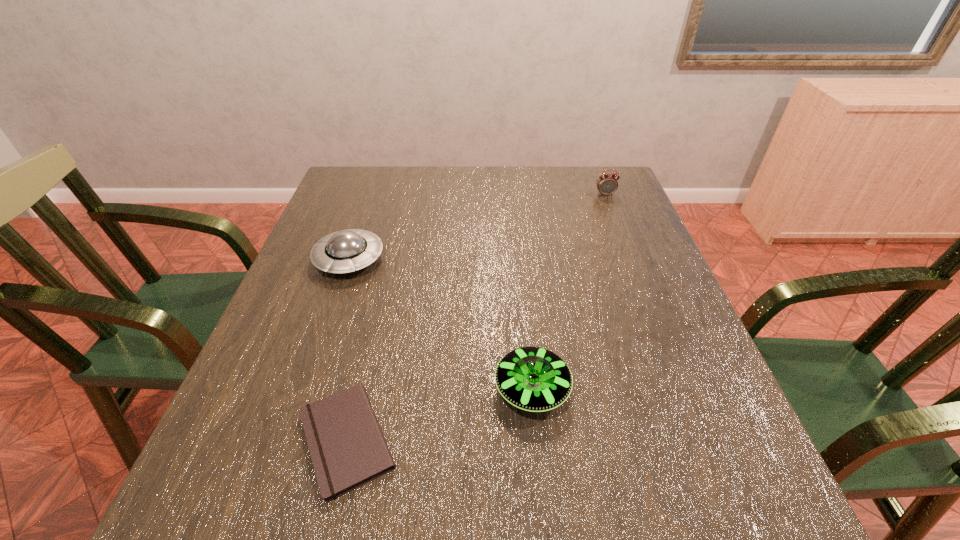
I want to click on free space located on the back of the checkbook, so click(373, 326).

At what (x,y) coordinates should I click in order to perform the action: click on object at the far edge. Please return your answer as a coordinate pair (x, y). This screenshot has height=540, width=960. Looking at the image, I should click on (607, 184).

At what (x,y) coordinates should I click in order to perform the action: click on object that is at the near edge. Please return your answer as a coordinate pair (x, y). Looking at the image, I should click on (347, 447).

I want to click on saucer situated at the left edge, so click(x=345, y=251).

Find the location of a particular element. checkbook that is positioned at the left edge is located at coordinates (347, 447).

Identify the location of object that is at the right edge. (607, 184).

Where is `object present at the near left corner`? The width and height of the screenshot is (960, 540). object present at the near left corner is located at coordinates (347, 447).

You are a GUI agent. You are given a task and a screenshot of the screen. Output one action in this format:
    pyautogui.click(x=<x>, y=<y>)
    Task: Click on the object present at the far right corner
    The image size is (960, 540).
    Given the screenshot: What is the action you would take?
    pyautogui.click(x=607, y=184)

Locate an element on the screen. vacant area at the far edge is located at coordinates (544, 185).

In the image, there is a desktop. Where is `blank space at the near edge`? This screenshot has height=540, width=960. blank space at the near edge is located at coordinates (475, 485).